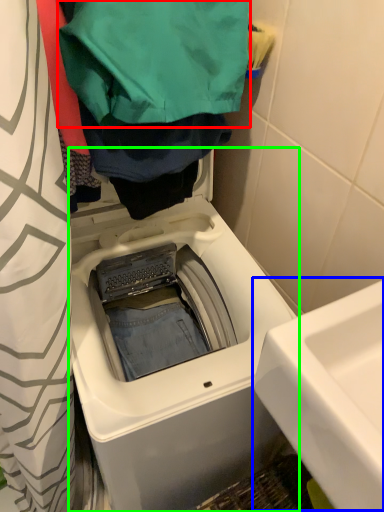
Question: Based on their relative distances, which object is nearer to clothing (highlighted by a red box)? Choose from sink (highlighted by a blue box) and washing machine (highlighted by a green box).

Choices:
 (A) sink
 (B) washing machine

Answer: (B)